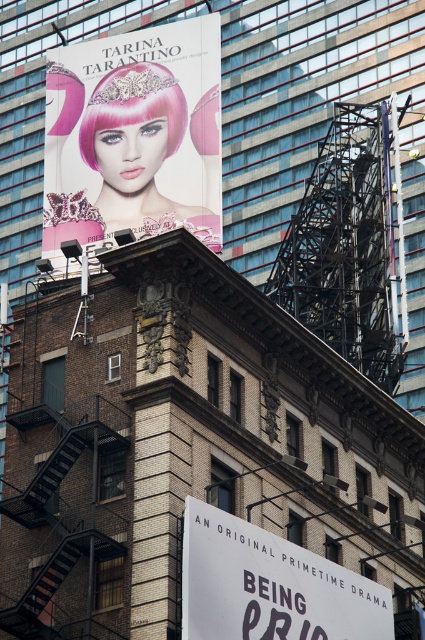
Is white paper sign at lower center to the right of black metal fire escape at lower left from the viewer's perspective?

Yes, white paper sign at lower center is to the right of black metal fire escape at lower left.

Does white paper sign at lower center have a lesser width compared to black metal fire escape at lower left?

No.

The height and width of the screenshot is (640, 425). I want to click on white paper sign at lower center, so click(x=269, y=586).

Who is more forward, (186, 61) or (172, 93)?

Point (172, 93) is more forward.

Can you confirm if matte pink wig at upper left is wider than pink matte wig at upper left?

Yes, matte pink wig at upper left is wider than pink matte wig at upper left.

In the scene shown: Who is more distant from viewer, [87,125] or [158,83]?

The point [87,125] is more distant.

You are a GUI agent. You are given a task and a screenshot of the screen. Output one action in this format:
    pyautogui.click(x=<x>, y=<y>)
    Task: Click on the matte pink wig at upper left
    The width and height of the screenshot is (425, 640).
    Given the screenshot: What is the action you would take?
    pyautogui.click(x=135, y=134)

Is matte pink wig at upper left wider than white paper sign at lower center?

Indeed, matte pink wig at upper left has a greater width compared to white paper sign at lower center.

Measure the distance between matte pink wig at upper left and camera.

220.14 feet

Which is in front, point (101, 195) or point (189, 547)?

Point (189, 547) is in front.

This screenshot has width=425, height=640. I want to click on matte pink wig at upper left, so click(x=135, y=134).